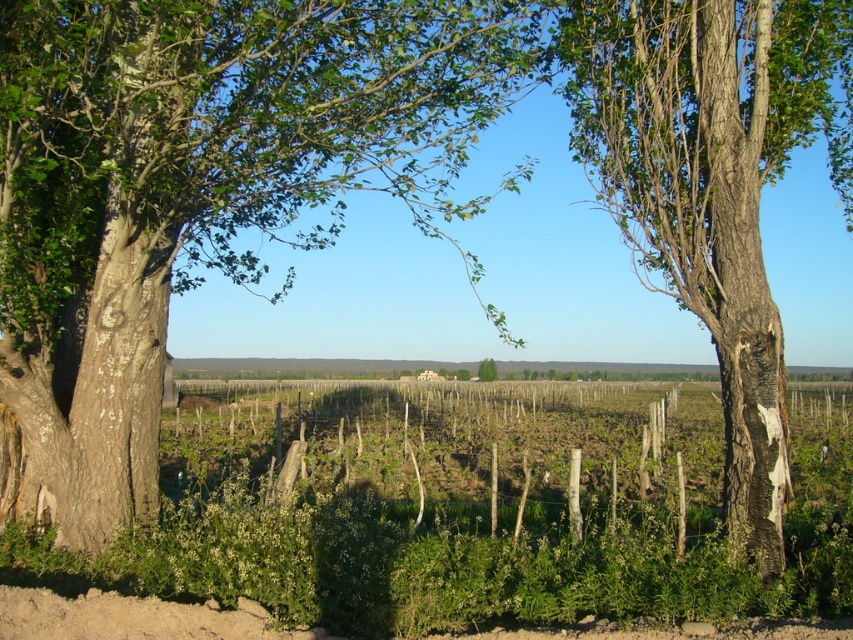
You are standing in the vineyard and see the smooth brown tree trunk at left and the green leafy tree at center. Which tree is positioned more to the left side of the scene?

The smooth brown tree trunk at left is positioned more to the left side of the scene compared to the green leafy tree at center.

In the rural landscape scene, there are two prominent trees framing the scene. Their trunks are thick and textured, with patches of white lichen or similar growth. You are standing at the point indicated by the coordinates point (201, 184). Which tree trunk are you facing towards? The options are the smooth brown tree trunk at left or the textured trunk with white lichen.

The point (201, 184) indicates smooth brown tree trunk at left, so you are facing towards the smooth brown tree trunk at left.